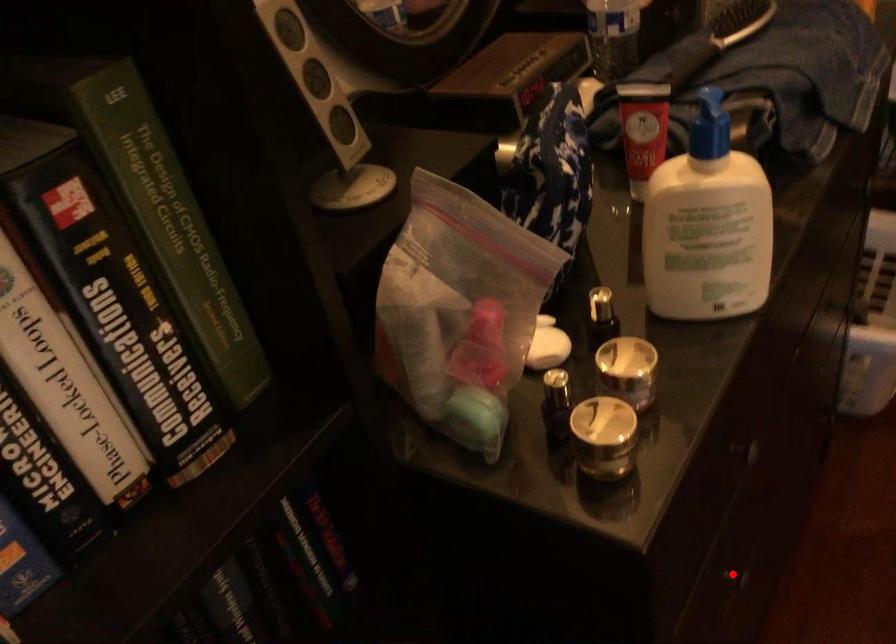
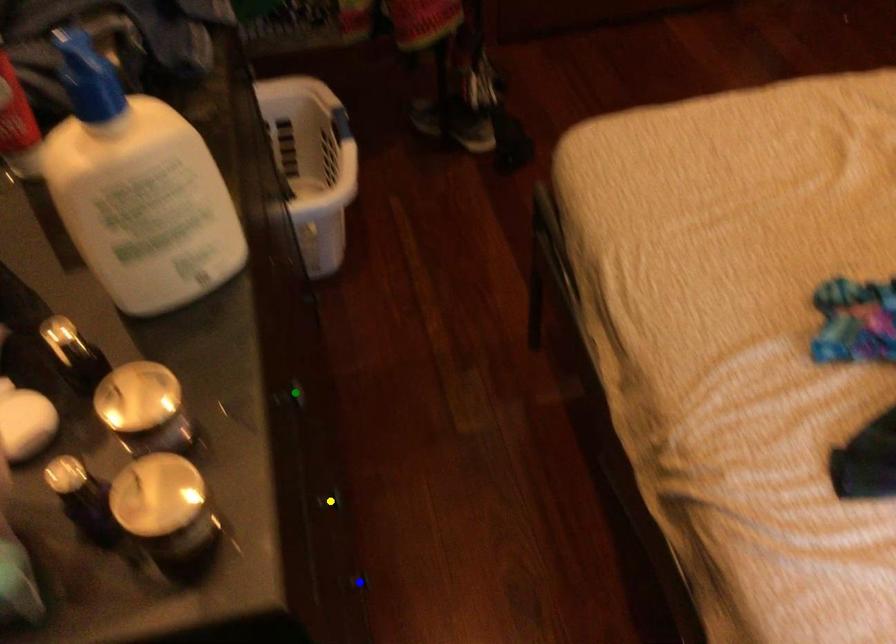
Question: I am providing you with two images of the same scene from different viewpoints. A red point is marked on the first image. You are given multiple points on the second image. Can you choose the point in image 2 that corresponds to the point in image 1?

Choices:
 (A) green point
 (B) yellow point
 (C) blue point

Answer: (B)